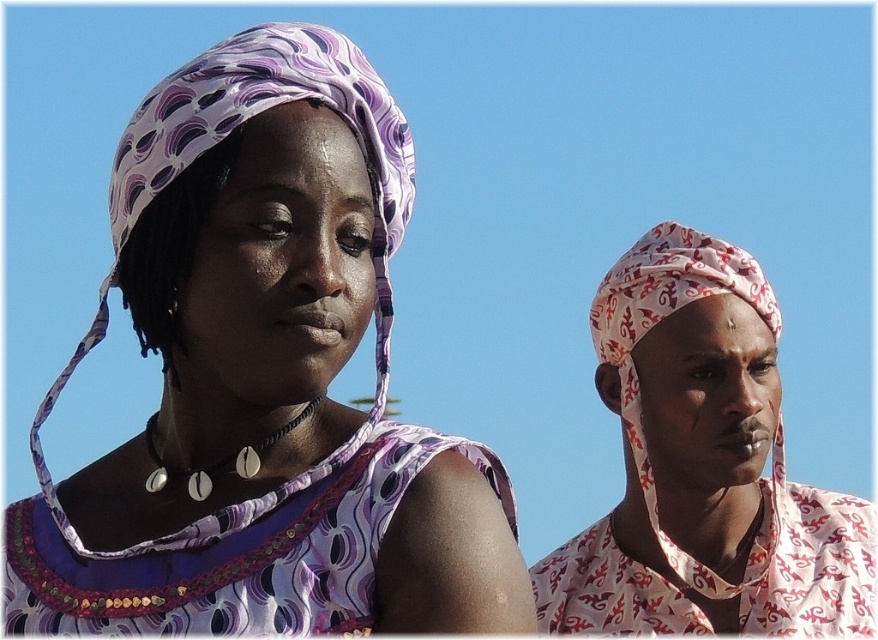
Question: Does printed fabric headscarf at right appear on the left side of purple fabric dress at left?

Choices:
 (A) no
 (B) yes

Answer: (A)

Question: Which of the following is the farthest from the observer?

Choices:
 (A) purple fabric dress at left
 (B) purple printed headscarf at upper left

Answer: (A)

Question: Which object is the closest to the purple fabric dress at left?

Choices:
 (A) purple printed headscarf at upper left
 (B) printed fabric headscarf at right

Answer: (A)

Question: Which point is closer to the camera taking this photo?

Choices:
 (A) (255, 364)
 (B) (328, 480)

Answer: (B)

Question: Does purple printed headscarf at upper left have a larger size compared to purple fabric dress at left?

Choices:
 (A) no
 (B) yes

Answer: (B)

Question: Is purple printed headscarf at upper left to the left of printed fabric headscarf at right from the viewer's perspective?

Choices:
 (A) no
 (B) yes

Answer: (B)